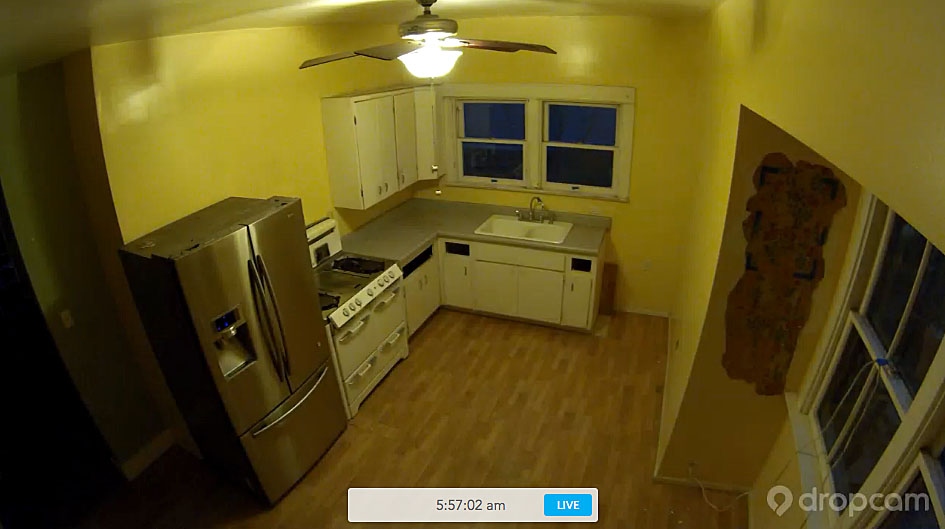
What are the coordinates of `wall decoration` in the screenshot? It's located at (783, 229).